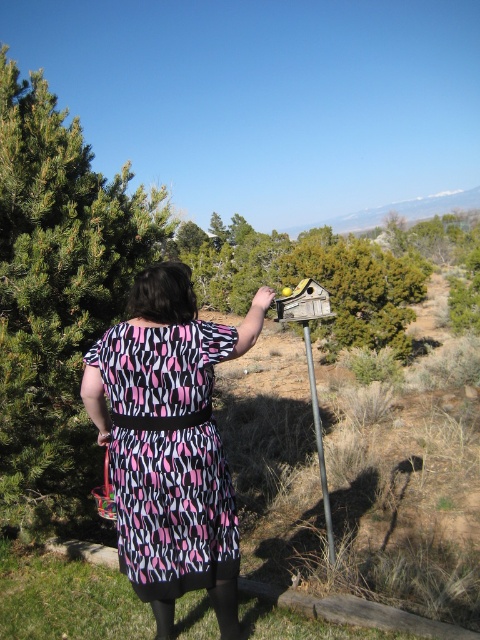
You are a photographer trying to capture the pink and black dotted fabric dress at center and the green leafy tree at left in the same frame. Based on their positions, will the tree block the view of the dress?

The pink and black dotted fabric dress at center is behind the green leafy tree at left, so the tree will block the view of the dress.

You are a photographer trying to capture the birdhouse and the person in the image. You need to position yourself so that the two points, point (38, 214) and point (126, 404), are both visible in your frame. Based on their spatial relationship, which point should you prioritize keeping closer to the camera to ensure both are in view?

Point (126, 404) should be prioritized as it is closer to the camera than point (38, 214), which is behind it. By keeping point (126, 404) closer to the camera, both points can be captured in the frame since the other point is behind it.

You are a photographer trying to capture a clear shot of the metallic pole at center. The person wearing the pink and black dotted fabric dress at center is blocking your view. Can you estimate whether the dress is wider than the pole to determine if moving the person might be necessary?

The pink and black dotted fabric dress at center might be wider than metallic pole at center, so moving the person wearing the pink and black dotted fabric dress at center might be necessary to ensure the pole is fully visible in the photo.